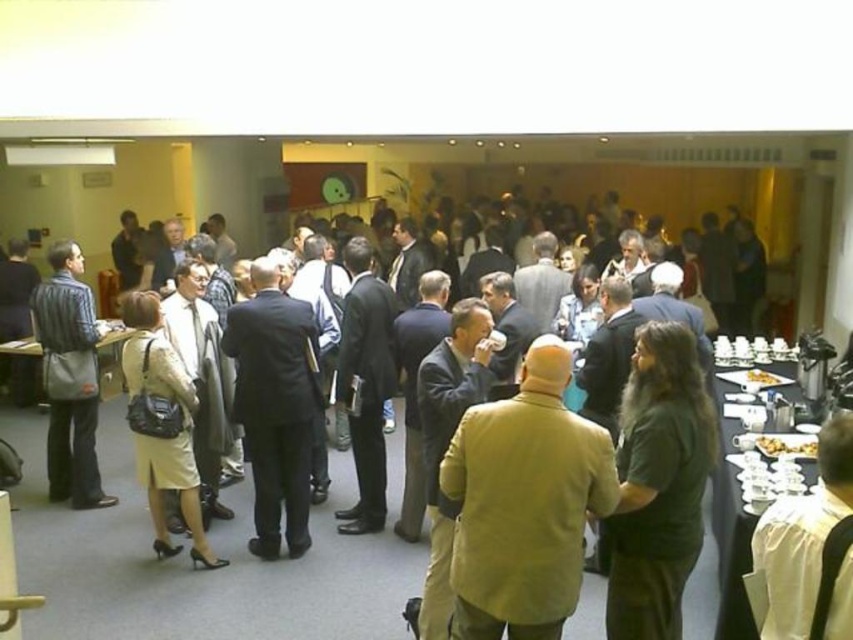
Can you confirm if dark green shirt at center is positioned above black plastic table at right?

No.

Is dark green shirt at center to the right of black plastic table at right from the viewer's perspective?

Incorrect, dark green shirt at center is not on the right side of black plastic table at right.

Is point (625, 534) in front of point (821, 342)?

Yes, it is in front of point (821, 342).

I want to click on dark green shirt at center, so click(659, 484).

Can you confirm if dark suit at center is wider than matte black bag at left?

Incorrect, dark suit at center's width does not surpass matte black bag at left's.

Is dark suit at center above matte black bag at left?

Incorrect, dark suit at center is not positioned above matte black bag at left.

Find the location of a particular element. dark suit at center is located at coordinates (276, 404).

Image resolution: width=853 pixels, height=640 pixels. What are the coordinates of `dark suit at center` in the screenshot? It's located at [276, 404].

Between dark green shirt at center and matte black bag at left, which one is positioned higher?

matte black bag at left is higher up.

Who is more forward, (647, 538) or (77, 420)?

Positioned in front is point (647, 538).

Is point (645, 440) positioned before point (45, 358)?

Yes, point (645, 440) is in front of point (45, 358).

Where is `dark green shirt at center`? dark green shirt at center is located at coordinates (659, 484).